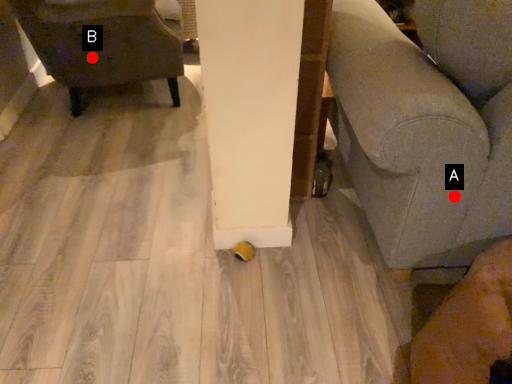
Question: Two points are circled on the image, labeled by A and B beside each circle. Which point is farther from the camera taking this photo?

Choices:
 (A) A is further
 (B) B is further

Answer: (B)